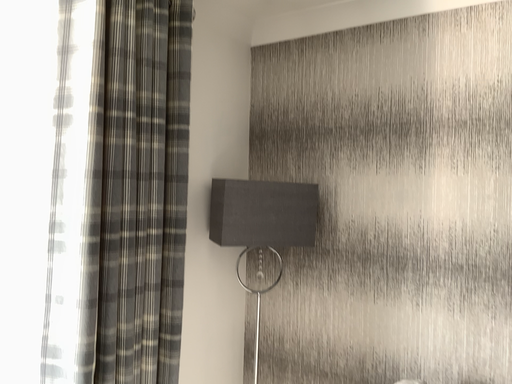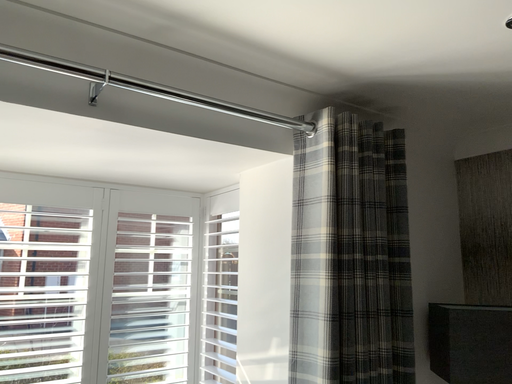
Question: Which way did the camera rotate in the video?

Choices:
 (A) rotated right
 (B) rotated left

Answer: (B)